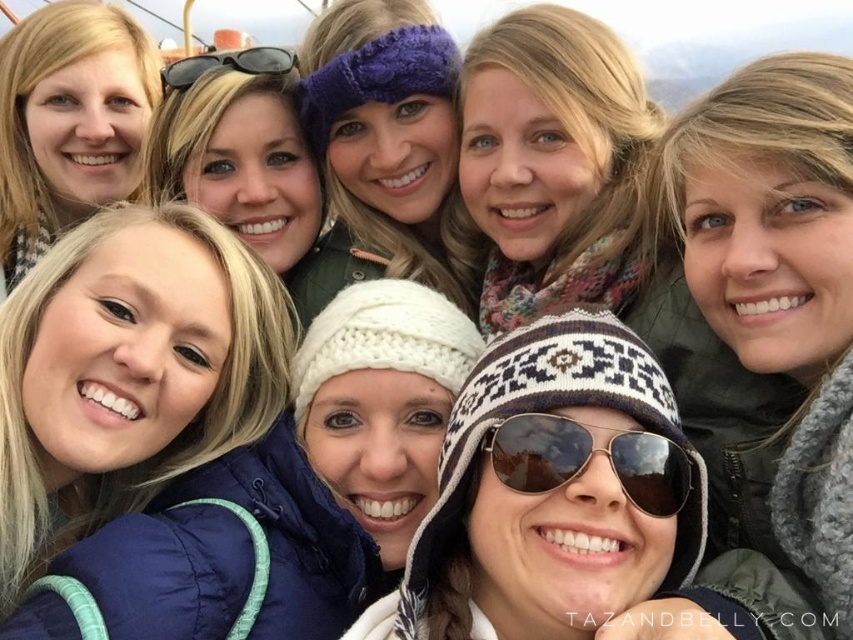
Who is positioned more to the right, matte black hair at upper left or gold metallic goggles at center?

Positioned to the right is gold metallic goggles at center.

Is matte black hair at upper left positioned behind gold metallic goggles at center?

Yes, matte black hair at upper left is further from the viewer.

Is point (65, 225) closer to camera compared to point (622, 451)?

No, it is not.

You are a GUI agent. You are given a task and a screenshot of the screen. Output one action in this format:
    pyautogui.click(x=<x>, y=<y>)
    Task: Click on the matte black hair at upper left
    The image size is (853, 640).
    Given the screenshot: What is the action you would take?
    pyautogui.click(x=68, y=122)

Does gray knitted scarf at upper right appear on the right side of purple fuzzy headband at center?

Yes, gray knitted scarf at upper right is to the right of purple fuzzy headband at center.

Who is higher up, gray knitted scarf at upper right or purple fuzzy headband at center?

purple fuzzy headband at center

Measure the distance between gray knitted scarf at upper right and camera.

gray knitted scarf at upper right is 5.92 meters away from camera.

This screenshot has height=640, width=853. What are the coordinates of `gray knitted scarf at upper right` in the screenshot? It's located at (781, 278).

In the scene shown: Can you confirm if gray knitted scarf at upper right is bigger than gold metallic goggles at center?

Yes.

Who is more forward, (834, 250) or (532, 435)?

Positioned in front is point (532, 435).

Describe the element at coordinates (781, 278) in the screenshot. This screenshot has height=640, width=853. I see `gray knitted scarf at upper right` at that location.

Locate an element on the screen. The width and height of the screenshot is (853, 640). gray knitted scarf at upper right is located at coordinates (781, 278).